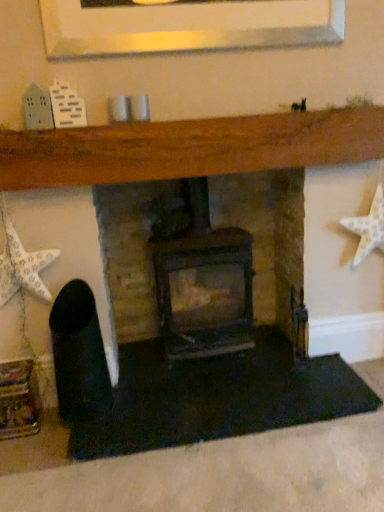
Where is `vacant point above rustic stone fireplace at center (from a real-world perspective)`? vacant point above rustic stone fireplace at center (from a real-world perspective) is located at coordinates (243, 101).